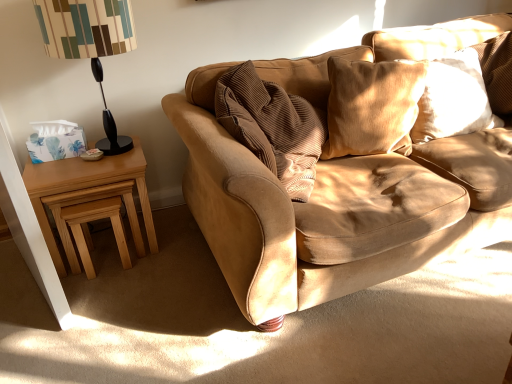
At what (x,y) coordinates should I click in order to perform the action: click on vacant space to the right of light brown wooden stool at lower left. Please return your answer as a coordinate pair (x, y). Looking at the image, I should click on (159, 255).